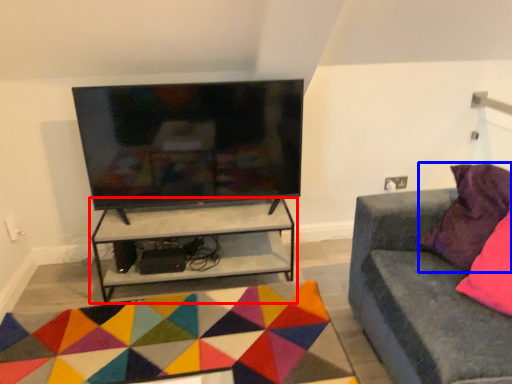
Question: Which object is further to the camera taking this photo, shelf (highlighted by a red box) or pillow (highlighted by a blue box)?

Choices:
 (A) shelf
 (B) pillow

Answer: (A)